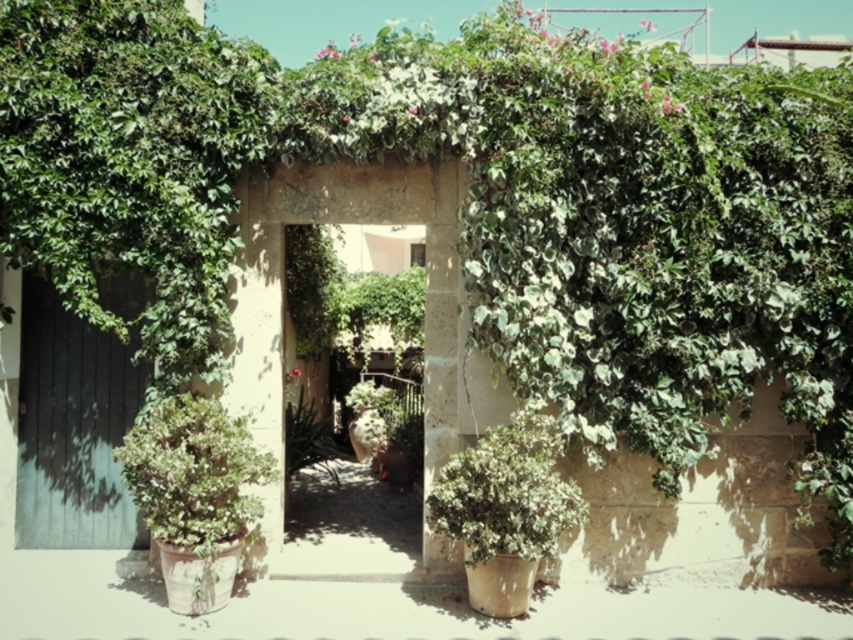
Does green leafy archway at center lie behind green matte plant at center?

Yes.

Is green leafy archway at center taller than green matte plant at center?

Correct, green leafy archway at center is much taller as green matte plant at center.

Who is more forward, [270,308] or [553,493]?

Positioned in front is point [553,493].

The height and width of the screenshot is (640, 853). I want to click on green leafy archway at center, so click(344, 221).

Is green leafy archway at center thinner than green matte potted plant at left?

In fact, green leafy archway at center might be wider than green matte potted plant at left.

Which is more to the right, green leafy archway at center or green matte potted plant at left?

Positioned to the right is green leafy archway at center.

This screenshot has width=853, height=640. What are the coordinates of `green leafy archway at center` in the screenshot? It's located at (344, 221).

Is point (102, 378) positioned behind point (186, 468)?

Yes, point (102, 378) is farther from viewer.

Image resolution: width=853 pixels, height=640 pixels. What do you see at coordinates (73, 428) in the screenshot?
I see `dark wood door at left` at bounding box center [73, 428].

Find the location of a particular element. The image size is (853, 640). dark wood door at left is located at coordinates (73, 428).